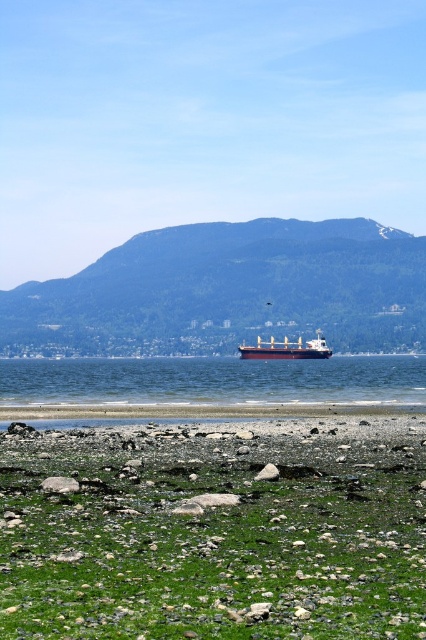
Which is in front, point (77, 452) or point (284, 342)?

Point (77, 452) is more forward.

What do you see at coordinates (215, 531) in the screenshot? This screenshot has width=426, height=640. I see `green mossy rocks at lower center` at bounding box center [215, 531].

Locate an element on the screen. The image size is (426, 640). green mossy rocks at lower center is located at coordinates (215, 531).

Does blue water at center have a greater width compared to white matte cargo ship at center?

Yes.

Can you confirm if blue water at center is thinner than white matte cargo ship at center?

No, blue water at center is not thinner than white matte cargo ship at center.

Does point (195, 374) lie behind point (314, 344)?

No, (195, 374) is in front of (314, 344).

Where is `blue water at center`? blue water at center is located at coordinates (215, 380).

The height and width of the screenshot is (640, 426). I want to click on green forested mountain at center, so click(229, 291).

Is green forested mountain at center positioned in front of white matte cargo ship at center?

No.

Does point (157, 268) lie behind point (271, 337)?

Yes.

At what (x,y) coordinates should I click in order to perform the action: click on green forested mountain at center. Please return your answer as a coordinate pair (x, y). Looking at the image, I should click on (229, 291).